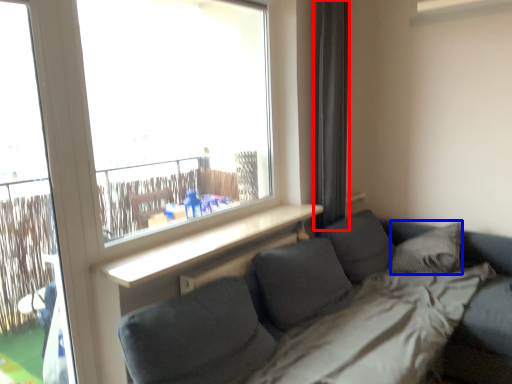
Question: Which object appears farthest to the camera in this image, curtain (highlighted by a red box) or pillow (highlighted by a blue box)?

Choices:
 (A) curtain
 (B) pillow

Answer: (A)